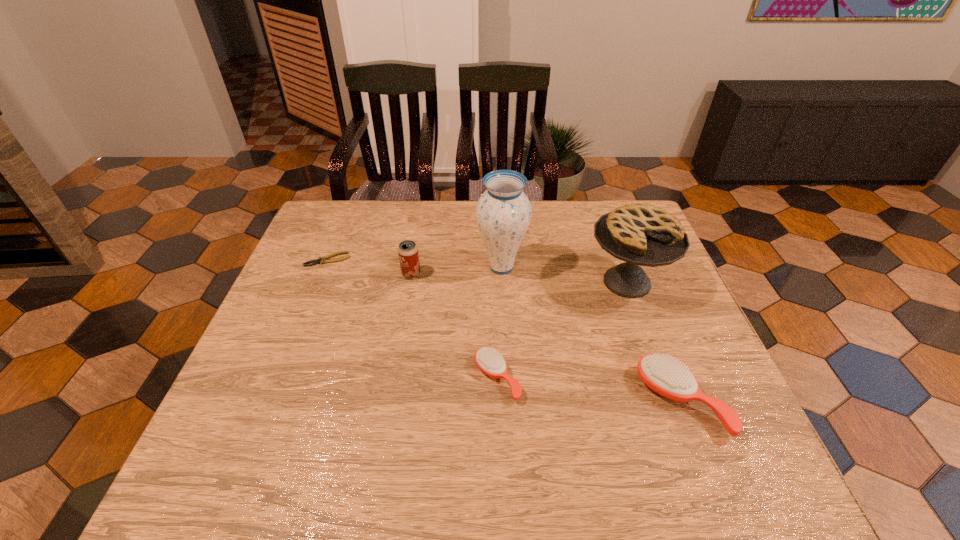
The width and height of the screenshot is (960, 540). Identify the location of free spot between the fifth tallest object and the taller hairbrush. (589, 390).

Find the location of a particular element. vacant space that's between the pie and the beer can is located at coordinates (519, 278).

At what (x,y) coordinates should I click in order to perform the action: click on unoccupied position between the fourth tallest object and the leftmost object. Please return your answer as a coordinate pair (x, y). This screenshot has width=960, height=540. Looking at the image, I should click on (505, 330).

Identify the location of vacant space that's between the left hairbrush and the taller hairbrush. (589, 390).

In order to click on vacant point located between the leftmost object and the fifth shortest object in this screenshot , I will do `click(477, 271)`.

Where is `object that is the second nearest to the shortest object`? The height and width of the screenshot is (540, 960). object that is the second nearest to the shortest object is located at coordinates (503, 213).

Locate an element on the screen. The image size is (960, 540). object that can be found as the second closest to the beer can is located at coordinates (321, 260).